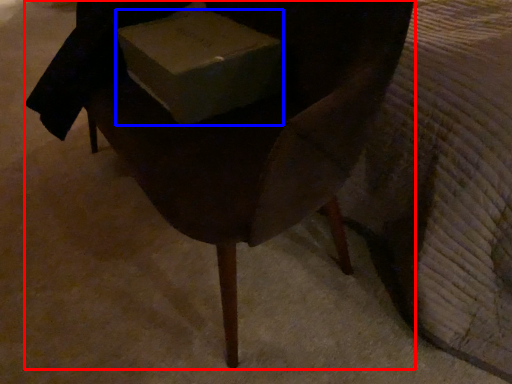
Question: Which object appears closest to the camera in this image, chair (highlighted by a red box) or box (highlighted by a blue box)?

Choices:
 (A) chair
 (B) box

Answer: (A)